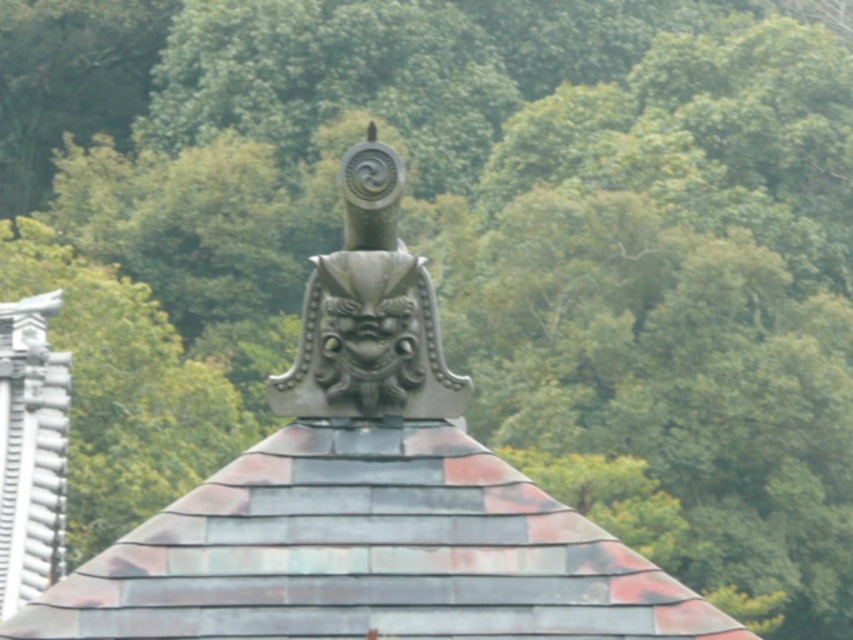
Who is lower down, shiny copper tiles at center or metallic gray dragon head at center?

shiny copper tiles at center

Based on the photo, can you confirm if shiny copper tiles at center is positioned above metallic gray dragon head at center?

Actually, shiny copper tiles at center is below metallic gray dragon head at center.

Is point (695, 611) behind point (415, 259)?

No, (695, 611) is closer to viewer.

Find the location of a particular element. shiny copper tiles at center is located at coordinates (368, 552).